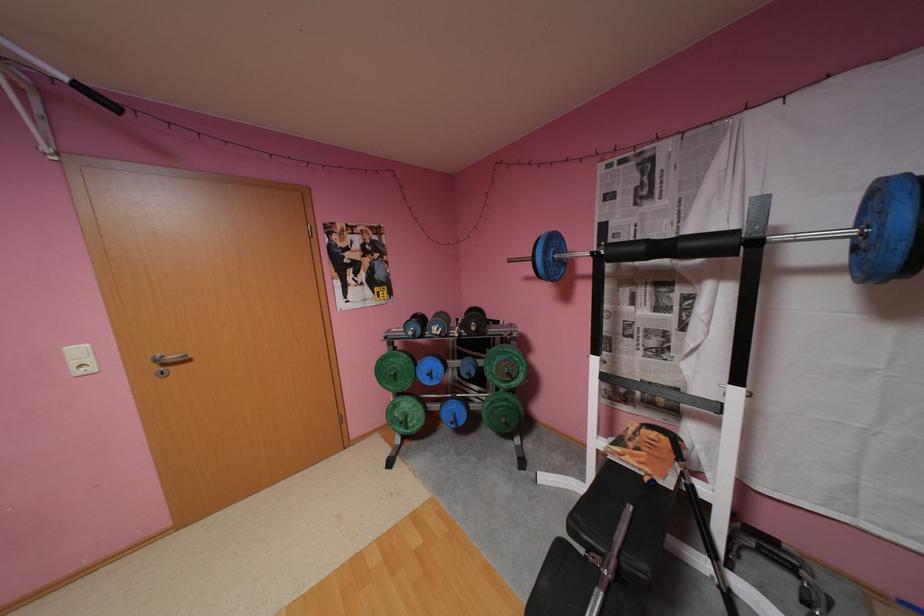
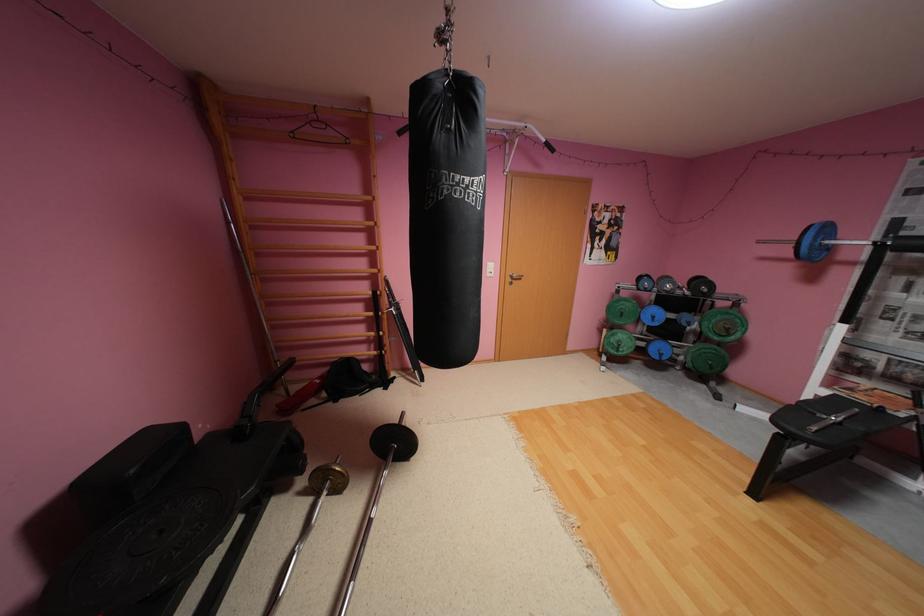
The point at (563, 241) is marked in the first image. Where is the corresponding point in the second image?

(835, 229)